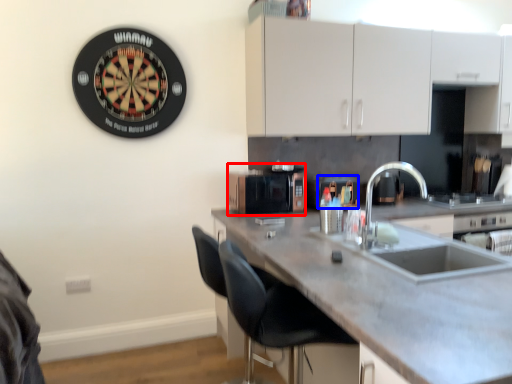
Question: Which point is closer to the camera, appliance (highlighted by a red box) or appliance (highlighted by a blue box)?

Choices:
 (A) appliance
 (B) appliance

Answer: (A)